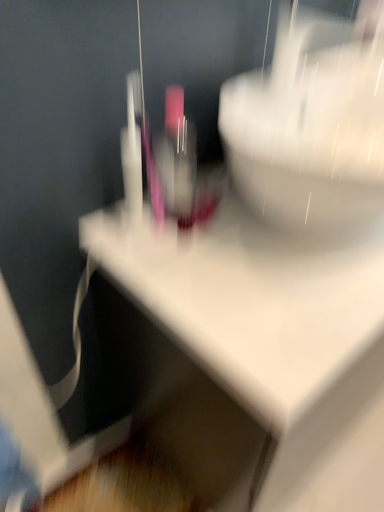
Measure the distance between point (254, 348) and camera.

Point (254, 348) is 55.00 centimeters from camera.

Where is `white glossy table at center`? This screenshot has height=512, width=384. white glossy table at center is located at coordinates (272, 335).

What do you see at coordinates (272, 335) in the screenshot? I see `white glossy table at center` at bounding box center [272, 335].

Where is `white glossy table at center`? white glossy table at center is located at coordinates (272, 335).